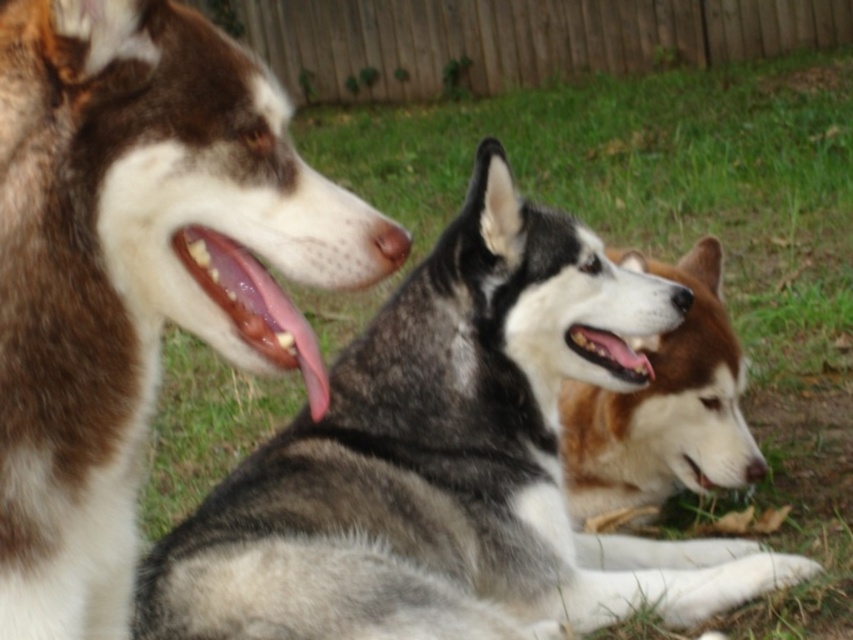
Is brown fur dog at left wider than brown fur dog at center?

Incorrect, brown fur dog at left's width does not surpass brown fur dog at center's.

Does brown fur dog at left appear over brown fur dog at center?

Indeed, brown fur dog at left is positioned over brown fur dog at center.

What are the coordinates of `brown fur dog at left` in the screenshot? It's located at 137,272.

What are the coordinates of `brown fur dog at left` in the screenshot? It's located at (137, 272).

Who is more forward, (x=550, y=502) or (x=56, y=300)?

Positioned in front is point (x=56, y=300).

Can you confirm if gray fur husky at center is shorter than brown fur dog at left?

In fact, gray fur husky at center may be taller than brown fur dog at left.

This screenshot has height=640, width=853. I want to click on gray fur husky at center, so click(x=447, y=465).

Does point (142, 81) come farther from viewer compared to point (178, 252)?

No, (142, 81) is in front of (178, 252).

Can you confirm if brown fur dog at left is positioned to the right of smooth pink tongue at center?

Incorrect, brown fur dog at left is not on the right side of smooth pink tongue at center.

Locate an element on the screen. This screenshot has height=640, width=853. brown fur dog at left is located at coordinates (137, 272).

Locate an element on the screen. Image resolution: width=853 pixels, height=640 pixels. brown fur dog at left is located at coordinates (137, 272).